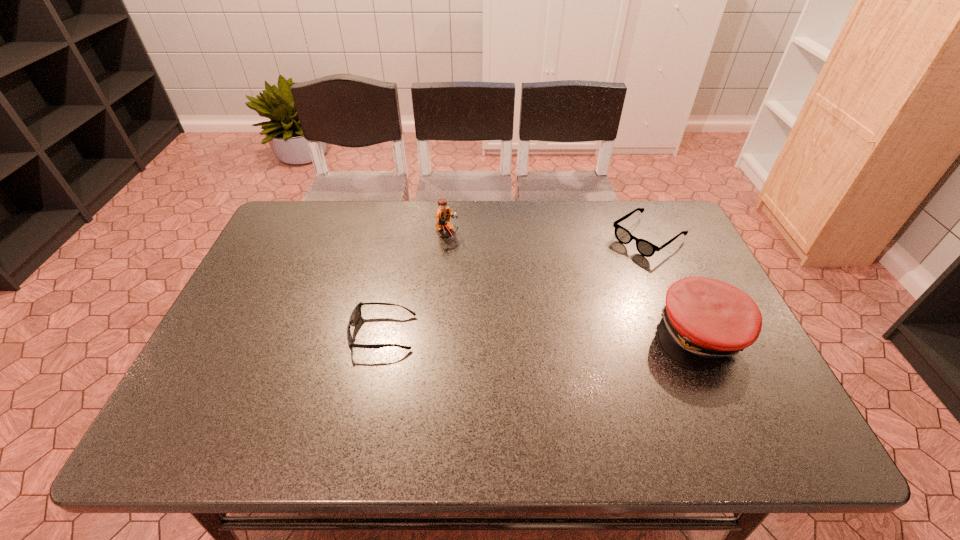
Locate an element on the screen. This screenshot has width=960, height=540. free location located 0.250m on the arms of the third tallest object is located at coordinates (569, 293).

Identify the location of free location located 0.130m on the arms of the third tallest object. (597, 273).

What are the coordinates of `vacant space positioned holding a crossbow in the hands of the third object from right to left` in the screenshot? It's located at (526, 295).

Where is `free point located 0.280m holding a crossbow in the hands of the third object from right to left`? The width and height of the screenshot is (960, 540). free point located 0.280m holding a crossbow in the hands of the third object from right to left is located at coordinates (521, 291).

Where is `free space located 0.220m holding a crossbow in the hands of the third object from right to left`? The width and height of the screenshot is (960, 540). free space located 0.220m holding a crossbow in the hands of the third object from right to left is located at coordinates (505, 280).

Identify the location of spectacles that is positioned at the far edge. (645, 248).

Locate an element on the screen. This screenshot has height=540, width=960. Lego that is at the far edge is located at coordinates (443, 214).

This screenshot has width=960, height=540. Find the location of `cap that is at the right edge`. cap that is at the right edge is located at coordinates (705, 321).

Image resolution: width=960 pixels, height=540 pixels. Identify the location of spectacles positioned at the right edge. (645, 248).

Identify the location of object that is at the far right corner. This screenshot has height=540, width=960. (645, 248).